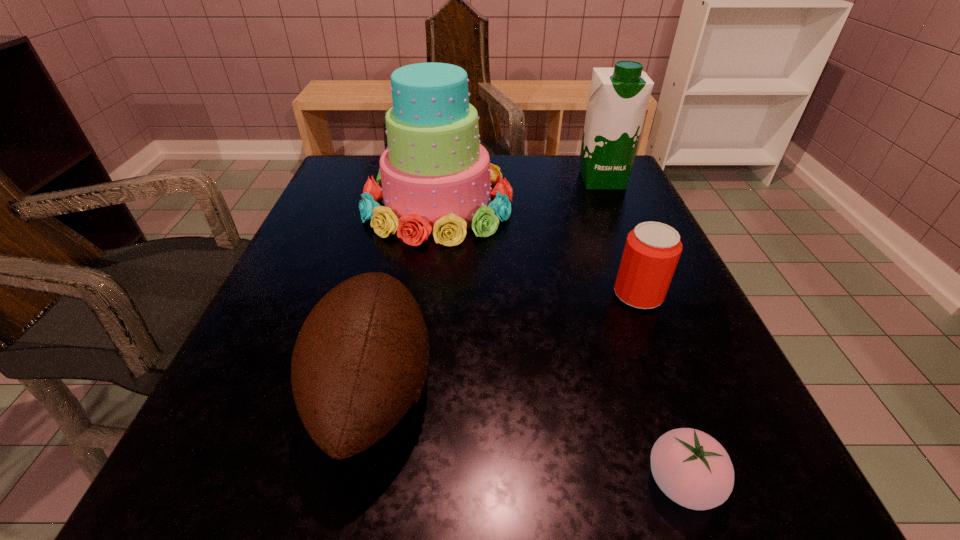
Locate which object is the fourth closest to the cake. Please provide its 2D coordinates. Your answer should be formatted as a tuple, i.e. [(x, y)], where the tuple contains the x and y coordinates of a point satisfying the conditions above.

[(693, 469)]

Locate which object is the fourth closest to the tomato. Please provide its 2D coordinates. Your answer should be formatted as a tuple, i.e. [(x, y)], where the tuple contains the x and y coordinates of a point satisfying the conditions above.

[(618, 97)]

You are a GUI agent. You are given a task and a screenshot of the screen. Output one action in this format:
    pyautogui.click(x=<x>, y=<y>)
    Task: Click on the free location that satisfies the following two spatial constraints: 1. on the laces of the football; 2. on the back side of the shortest object
    
    Given the screenshot: What is the action you would take?
    pyautogui.click(x=354, y=482)

Where is `free point that satisfies the following two spatial constraints: 1. on the front side of the cake; 2. on the laces of the football`? The width and height of the screenshot is (960, 540). free point that satisfies the following two spatial constraints: 1. on the front side of the cake; 2. on the laces of the football is located at coordinates (413, 390).

This screenshot has height=540, width=960. Find the location of `free space that satisfies the following two spatial constraints: 1. on the back side of the third nearest object; 2. on the right side of the shortest object`. free space that satisfies the following two spatial constraints: 1. on the back side of the third nearest object; 2. on the right side of the shortest object is located at coordinates (617, 295).

Where is `free location that satisfies the following two spatial constraints: 1. on the laces of the football; 2. on the right side of the shortest object`? free location that satisfies the following two spatial constraints: 1. on the laces of the football; 2. on the right side of the shortest object is located at coordinates (354, 482).